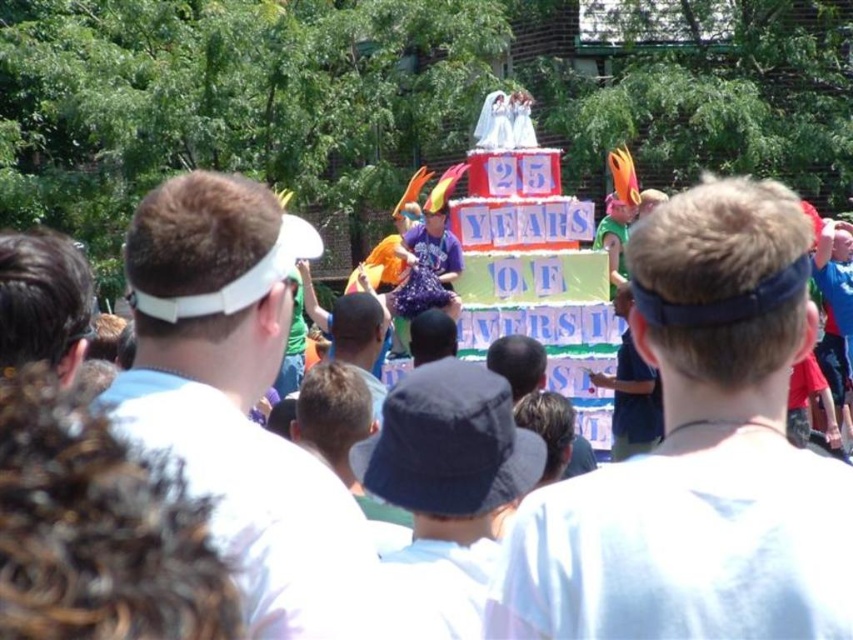
Does white fabric headband at center have a greater width compared to dark blue fabric bucket hat at center?

Indeed, white fabric headband at center has a greater width compared to dark blue fabric bucket hat at center.

The height and width of the screenshot is (640, 853). Describe the element at coordinates (698, 454) in the screenshot. I see `white fabric headband at center` at that location.

Which is behind, point (755, 349) or point (436, 598)?

The point (436, 598) is behind.

Find the location of a particular element. This screenshot has height=640, width=853. white fabric headband at center is located at coordinates (698, 454).

Does dark blue fabric bucket hat at center appear under purple fabric at center?

Indeed, dark blue fabric bucket hat at center is positioned under purple fabric at center.

Is dark blue fabric bucket hat at center above purple fabric at center?

Actually, dark blue fabric bucket hat at center is below purple fabric at center.

Is point (479, 460) closer to camera compared to point (427, 269)?

Yes, point (479, 460) is closer to viewer.

The height and width of the screenshot is (640, 853). Find the location of `dark blue fabric bucket hat at center`. dark blue fabric bucket hat at center is located at coordinates (447, 486).

Between dark blue fabric bucket hat at center and matte blue cap at center, which one is positioned lower?

dark blue fabric bucket hat at center

Can you confirm if dark blue fabric bucket hat at center is thinner than matte blue cap at center?

Incorrect, dark blue fabric bucket hat at center's width is not less than matte blue cap at center's.

Who is more distant from viewer, (396, 579) or (631, 212)?

Point (631, 212)

You are a GUI agent. You are given a task and a screenshot of the screen. Output one action in this format:
    pyautogui.click(x=<x>, y=<y>)
    Task: Click on the dark blue fabric bucket hat at center
    Image resolution: width=853 pixels, height=640 pixels.
    Given the screenshot: What is the action you would take?
    pyautogui.click(x=447, y=486)